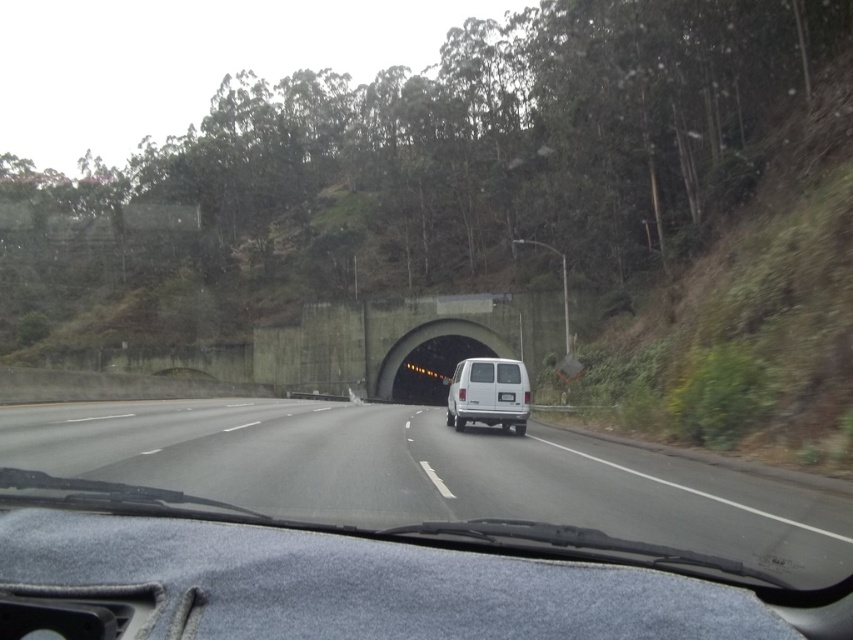
You are driving a car and want to overtake the white matte van at center on a highway. Based on the scene, can you safely move to the left lane to pass the van?

The white matte van at center is positioned at coordinates (488, 394), which suggests it is centrally located on the road. Since the highway has multiple lanes and the van is in the right lane, you can safely move to the left lane to overtake it if traffic conditions permit.

You are driving a car and see the white matte van at center and the concrete tunnel at center ahead. Which object is closer to you?

The white matte van at center is closer to you because it is positioned in front of the concrete tunnel at center.